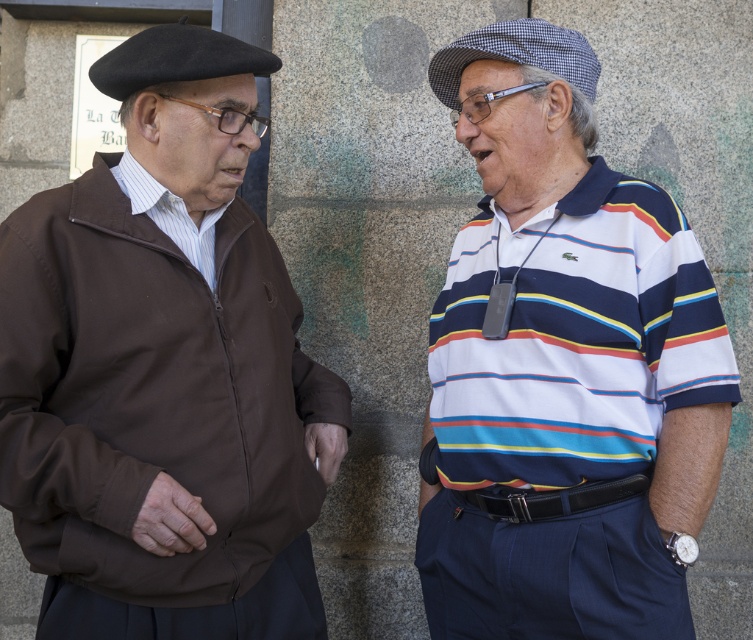
You are a photographer trying to capture a candid shot of the two men. Since you want to ensure the brown fabric jacket at left and the white striped polo shirt at center are both in focus, which one should you focus on first based on their positions?

The brown fabric jacket at left is positioned under the white striped polo shirt at center, so focusing on the white striped polo shirt at center first would ensure both are in focus as the jacket is closer to the camera.

You are a photographer trying to capture both the brown fabric jacket at left and the white striped polo shirt at center in a single frame. Based on their heights, which one should you adjust your camera angle to focus on first to ensure both are fully visible?

Since the brown fabric jacket at left is not as tall as the white striped polo shirt at center, you should adjust your camera angle to focus on the taller white striped polo shirt at center first to ensure both are fully visible.

You are a photographer trying to capture the exact position of the brown fabric jacket at left in the image. According to the coordinates provided, where should you focus your camera lens to ensure the jacket is centered in the frame?

The brown fabric jacket at left is positioned at coordinates point (163, 371), so you should focus your camera lens at that exact point to center the jacket in the frame.